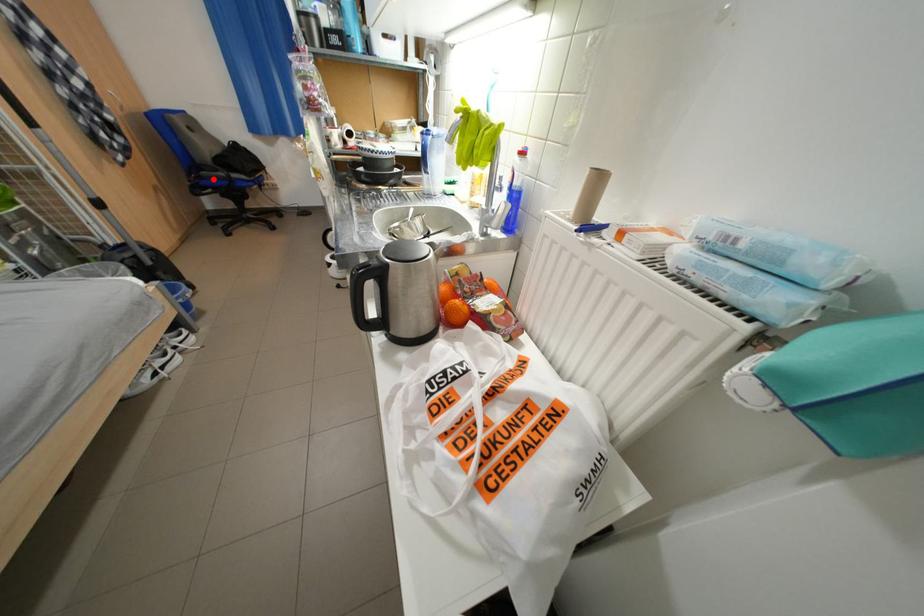
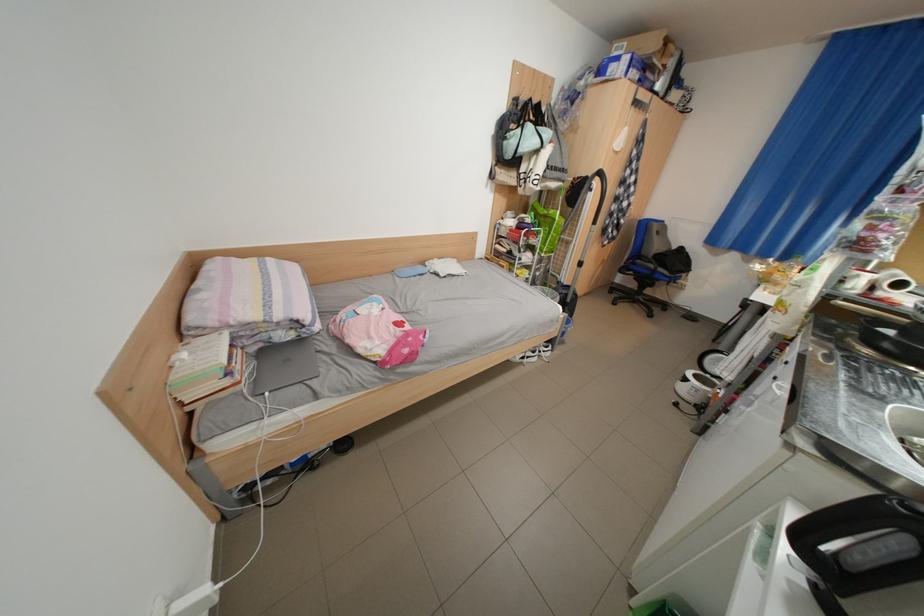
Locate, in the second image, the point that corresponds to the highlighted location in the first image.

(646, 265)